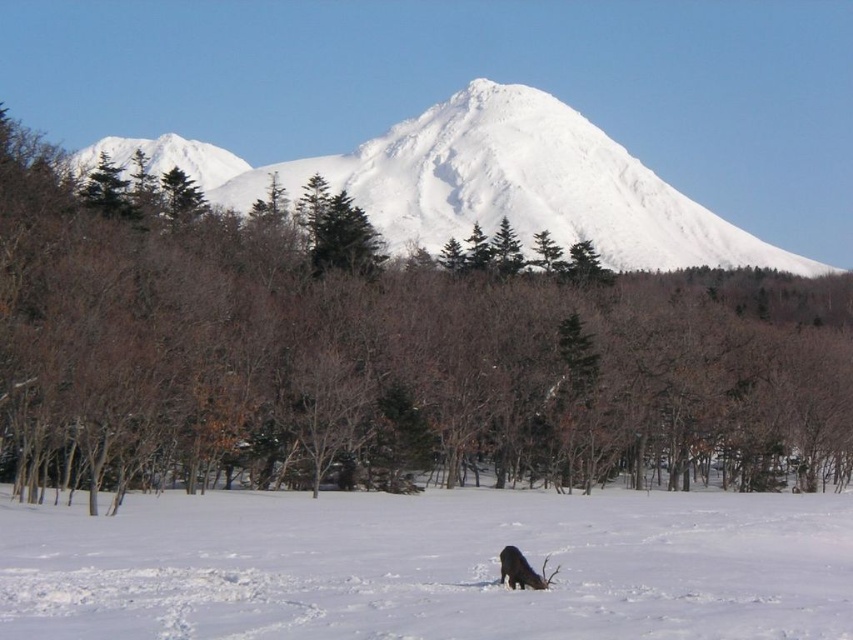
Question: Does white fluffy snow at center lie behind black fur at lower center?

Choices:
 (A) no
 (B) yes

Answer: (A)

Question: Is green leafy tree at center above white snow-covered mountain at upper left?

Choices:
 (A) no
 (B) yes

Answer: (A)

Question: Which of the following is the closest to the observer?

Choices:
 (A) (508, 564)
 (B) (431, 161)
 (C) (216, 161)
 (D) (424, 422)

Answer: (A)

Question: Among these objects, which one is nearest to the camera?

Choices:
 (A) white fluffy snow at center
 (B) green leafy tree at center
 (C) black fur at lower center

Answer: (A)

Question: Which of these objects is positioned closest to the white fluffy snow at center?

Choices:
 (A) green leafy tree at center
 (B) white snow-covered mountain at upper center

Answer: (A)

Question: Can you confirm if green leafy tree at center is bigger than white snow-covered mountain at upper left?

Choices:
 (A) no
 (B) yes

Answer: (B)